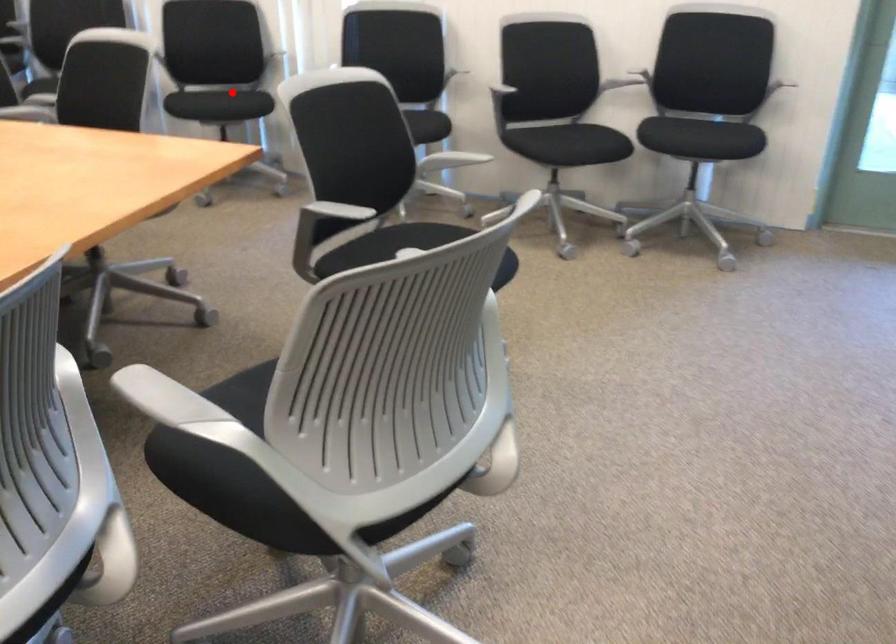
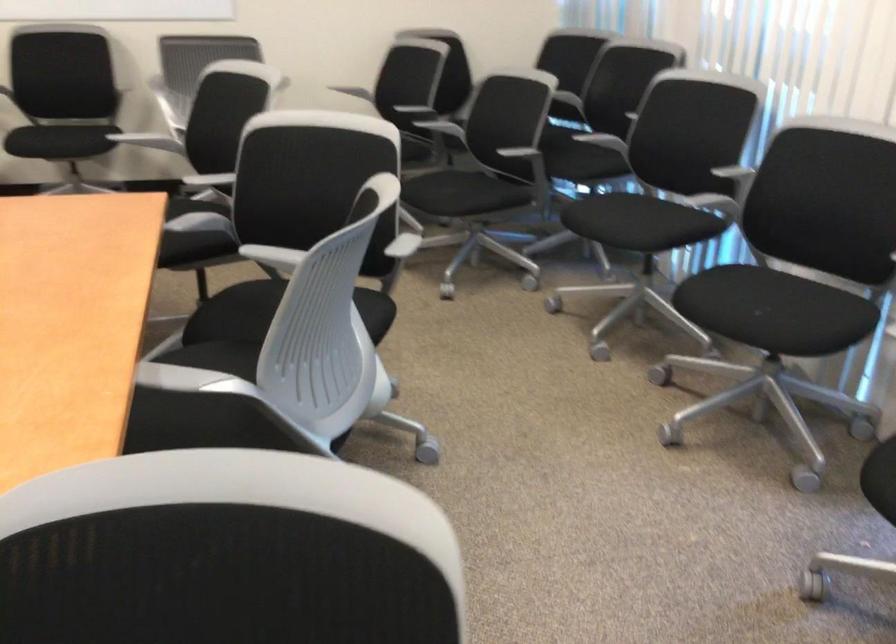
Find the pixel in the second image that matches the highlighted location in the first image.

(771, 310)